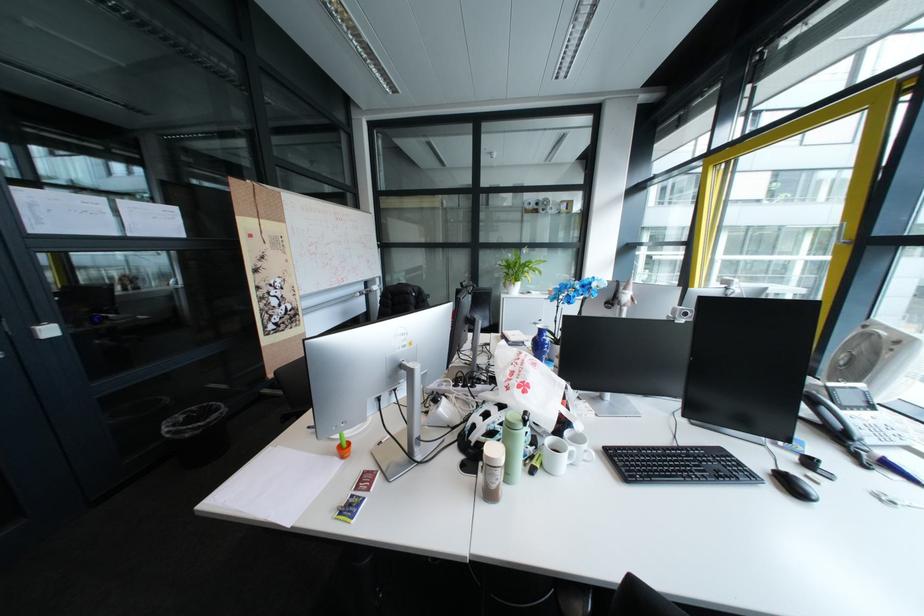
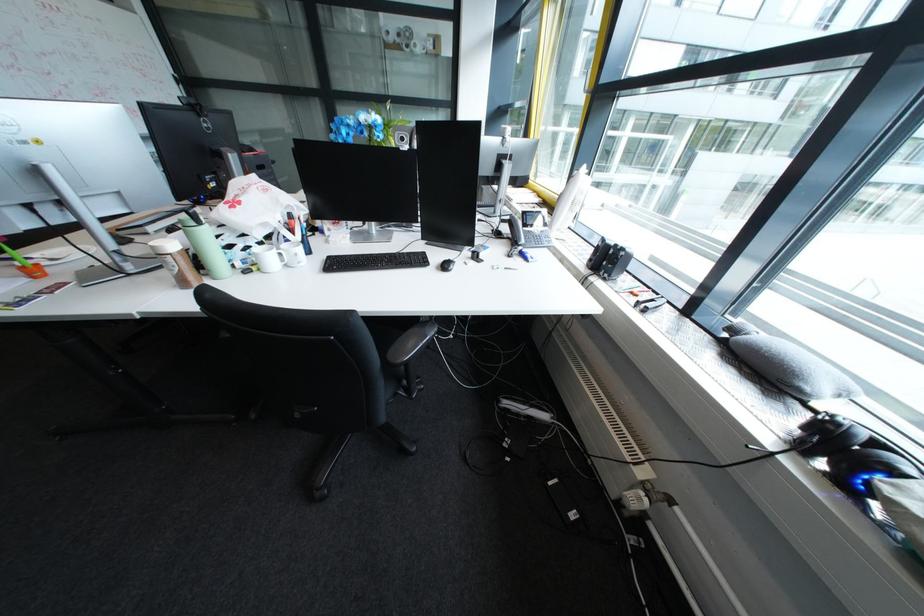
Find the pixel in the second image that matches the point at 776,480 in the first image.

(444, 264)